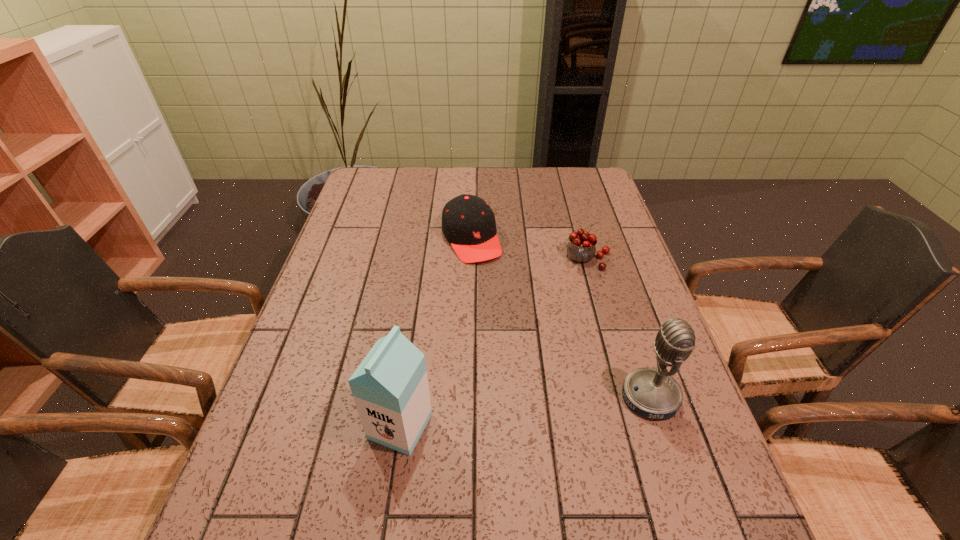
Locate an element on the screen. free space between the milk carton and the pot filled with cherries is located at coordinates (493, 342).

This screenshot has width=960, height=540. Identify the location of empty space that is in between the microphone and the cap. (561, 318).

Image resolution: width=960 pixels, height=540 pixels. What are the coordinates of `vacant space that is in between the cap and the milk carton` in the screenshot? It's located at (436, 333).

Identify the location of vacant space that's between the pot filled with cherries and the microphone. (618, 328).

Where is `vacant point located between the microphone and the pot filled with cherries`? vacant point located between the microphone and the pot filled with cherries is located at coordinates (618, 328).

The height and width of the screenshot is (540, 960). In order to click on unoccupied area between the milk carton and the cap in this screenshot , I will do `click(436, 333)`.

This screenshot has height=540, width=960. What are the coordinates of `free space between the milk carton and the cap` in the screenshot? It's located at (436, 333).

This screenshot has height=540, width=960. In order to click on blank region between the microphone and the cap in this screenshot , I will do `click(561, 318)`.

You are a GUI agent. You are given a task and a screenshot of the screen. Output one action in this format:
    pyautogui.click(x=<x>, y=<y>)
    Task: Click on the free space between the milk carton and the pot filled with cherries
    The image size is (960, 540).
    Given the screenshot: What is the action you would take?
    pyautogui.click(x=493, y=342)

The height and width of the screenshot is (540, 960). I want to click on free space between the pot filled with cherries and the microphone, so click(618, 328).